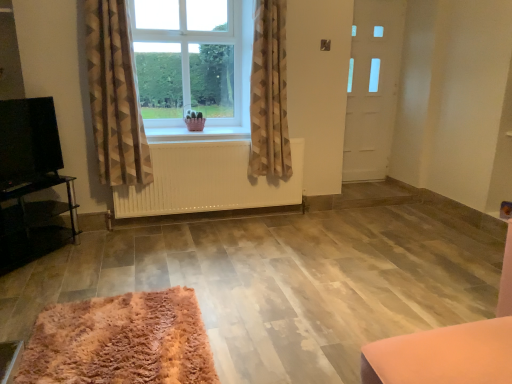
Question: From a real-world perspective, is black glossy tv at left physically above white wooden window sill at center?

Choices:
 (A) yes
 (B) no

Answer: (A)

Question: Considering the relative sizes of black glossy tv at left and white wooden window sill at center in the image provided, is black glossy tv at left smaller than white wooden window sill at center?

Choices:
 (A) no
 (B) yes

Answer: (B)

Question: Does black glossy tv at left appear on the right side of white wooden window sill at center?

Choices:
 (A) no
 (B) yes

Answer: (A)

Question: Considering the relative sizes of black glossy tv at left and white wooden window sill at center in the image provided, is black glossy tv at left thinner than white wooden window sill at center?

Choices:
 (A) no
 (B) yes

Answer: (B)

Question: Would you consider black glossy tv at left to be distant from white wooden window sill at center?

Choices:
 (A) yes
 (B) no

Answer: (B)

Question: From the image's perspective, would you say black glossy tv at left is positioned over white wooden window sill at center?

Choices:
 (A) yes
 (B) no

Answer: (B)

Question: Does white matte radiator at center lie in front of beige textured curtain at center, the 2th curtain from the left?

Choices:
 (A) yes
 (B) no

Answer: (B)

Question: Is white matte radiator at center shorter than beige textured curtain at center, the 2th curtain from the left?

Choices:
 (A) yes
 (B) no

Answer: (A)

Question: From the image's perspective, is white matte radiator at center beneath beige textured curtain at center, the 2th curtain from the left?

Choices:
 (A) yes
 (B) no

Answer: (A)

Question: Is beige textured curtain at center, the 2th curtain from the left, inside white matte radiator at center?

Choices:
 (A) yes
 (B) no

Answer: (B)

Question: Can you confirm if white matte radiator at center is smaller than beige textured curtain at center, the 2th curtain from the left?

Choices:
 (A) yes
 (B) no

Answer: (A)

Question: Is white matte radiator at center to the right of beige textured curtain at center, the 2th curtain from the left, from the viewer's perspective?

Choices:
 (A) yes
 (B) no

Answer: (B)

Question: Can you confirm if clear glass window at center is smaller than fluffy pink rug at lower left?

Choices:
 (A) no
 (B) yes

Answer: (A)